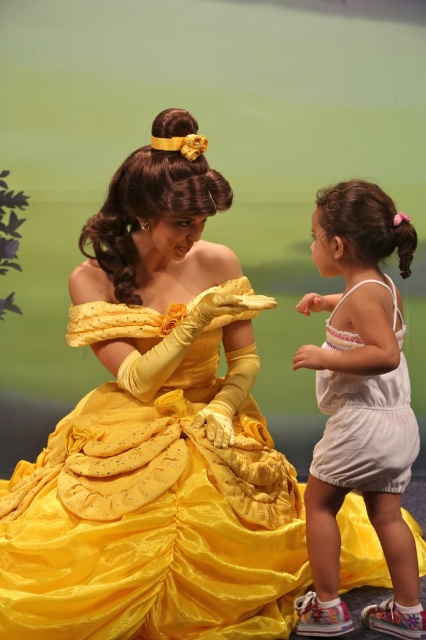
You are standing in a room with two people dressed in costumes. There is a point at coordinates (157, 435). Which costume does this point belong to?

The point at coordinates (157, 435) is on the matte yellow dress at center.

You are a photographer setting up for a group photo. You need to position the matte yellow dress at center and the white cotton romper at right so that both are visible in the frame. Considering their heights, which person should stand closer to the camera to ensure their faces are visible?

The white cotton romper at right is shorter than the matte yellow dress at center. To ensure both faces are visible, the white cotton romper at right should stand closer to the camera.

You are a photographer setting up for a group photo. You need to ensure that both the matte yellow dress at center and the white cotton romper at lower right are visible in the frame. Based on their positions, which one might be partially hidden if you focus on the other?

The white cotton romper at lower right might be partially hidden because the matte yellow dress at center is positioned over it.